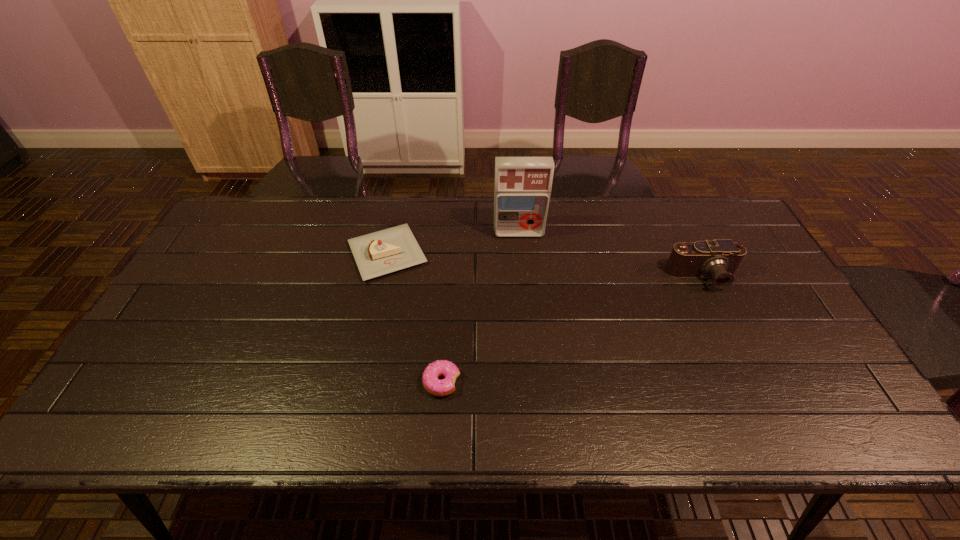
Identify which object is the third nearest to the leftmost object. Please provide its 2D coordinates. Your answer should be formatted as a tuple, i.e. [(x, y)], where the tuple contains the x and y coordinates of a point satisfying the conditions above.

[(720, 258)]

Point out which object is positioned as the third nearest to the rightmost object. Please provide its 2D coordinates. Your answer should be formatted as a tuple, i.e. [(x, y)], where the tuple contains the x and y coordinates of a point satisfying the conditions above.

[(389, 250)]

Find the location of `vacant space that satisfies the following two spatial constraints: 1. on the front side of the doughnut; 2. on the left side of the cake`. vacant space that satisfies the following two spatial constraints: 1. on the front side of the doughnut; 2. on the left side of the cake is located at coordinates (360, 382).